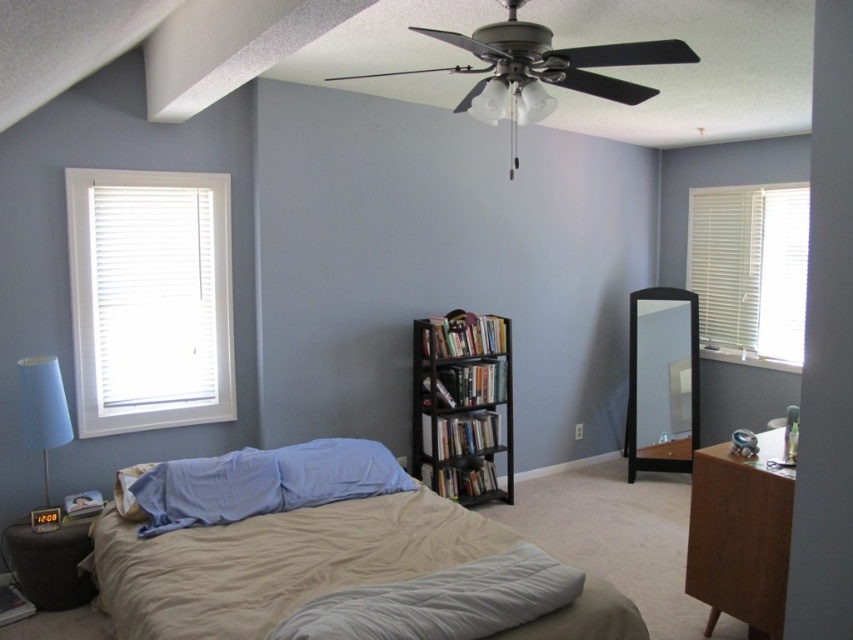
Question: Which object appears closest to the camera in this image?

Choices:
 (A) white blinds at right
 (B) white glass ceiling fan at upper center

Answer: (B)

Question: Which object is the closest to the matte blue lampshade at left?

Choices:
 (A) metallic gray ceiling fan at upper center
 (B) brown wooden dresser at right
 (C) black matte bookcase at center
 (D) beige fabric bed at center

Answer: (D)

Question: Which point is closer to the camera taking this photo?

Choices:
 (A) (496, 358)
 (B) (490, 115)
 (C) (294, 506)

Answer: (B)

Question: Does beige fabric bed at center have a smaller size compared to blue fabric pillow at center?

Choices:
 (A) no
 (B) yes

Answer: (A)

Question: Can you confirm if beige fabric bed at center is positioned to the left of matte blue lampshade at left?

Choices:
 (A) yes
 (B) no

Answer: (B)

Question: Where is brown wooden dresser at right located in relation to white glass ceiling fan at upper center in the image?

Choices:
 (A) above
 (B) below

Answer: (B)